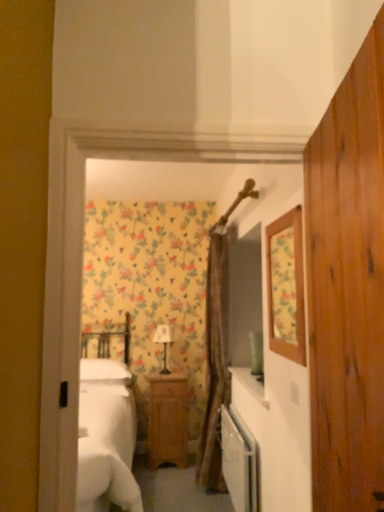
Question: Is floral wallpaper mirror at upper right in front of or behind wooden nightstand at center in the image?

Choices:
 (A) front
 (B) behind

Answer: (A)

Question: From a real-world perspective, relative to wooden nightstand at center, is floral wallpaper mirror at upper right vertically above or below?

Choices:
 (A) above
 (B) below

Answer: (A)

Question: Estimate the real-world distances between objects in this image. Which object is closer to the brown textured curtain at center?

Choices:
 (A) matte white lamp at center
 (B) wooden dresser at center
 (C) floral wallpaper mirror at upper right
 (D) wooden nightstand at center
 (E) white glossy dishwasher at center

Answer: (D)

Question: Considering the real-world distances, which object is closest to the matte white lamp at center?

Choices:
 (A) brown textured curtain at center
 (B) floral wallpaper mirror at upper right
 (C) white glossy dishwasher at center
 (D) wooden nightstand at center
 (E) wooden dresser at center

Answer: (D)